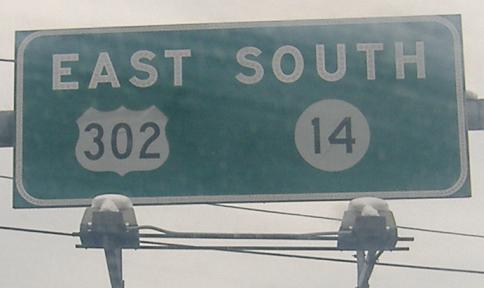
You are a GUI agent. You are given a task and a screenshot of the screen. Output one action in this format:
    pyautogui.click(x=<x>, y=<y>)
    Task: Click on the wires
    The height and width of the screenshot is (288, 484).
    Given the screenshot: What is the action you would take?
    pyautogui.click(x=407, y=265), pyautogui.click(x=437, y=230), pyautogui.click(x=321, y=233), pyautogui.click(x=42, y=231), pyautogui.click(x=3, y=173), pyautogui.click(x=11, y=59)